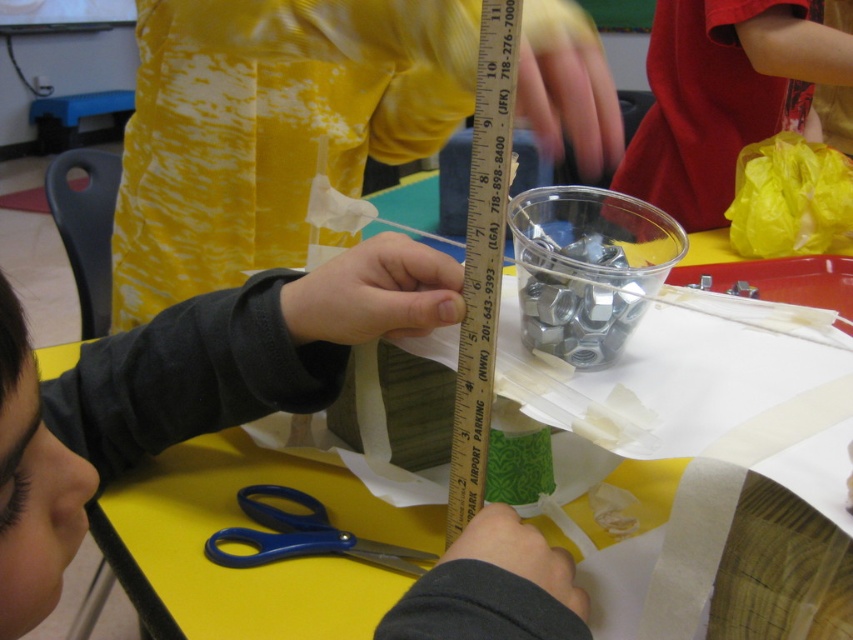
You are a photographer standing at a distance of 24.27 inches from the point at coordinates point [347,502]. If you want to take a closeup shot of this point, should you move closer or farther away?

The photographer is currently 24.27 inches away from the point at coordinates point [347,502]. To take a closeup shot, they should move closer to reduce the distance between themselves and the point.

You are a robot observing the scene. There are two points marked on the table surface, point (480, 451) and point (242, 493). From your perspective, which point is closer to you?

Point (480, 451) is in front of point (242, 493), so it is closer to you.

Looking at the crafting setup on the yellow table, where is the yellow paper at center in relation to the blue plastic scissors at lower center?

The yellow paper at center is to the left of the blue plastic scissors at lower center.